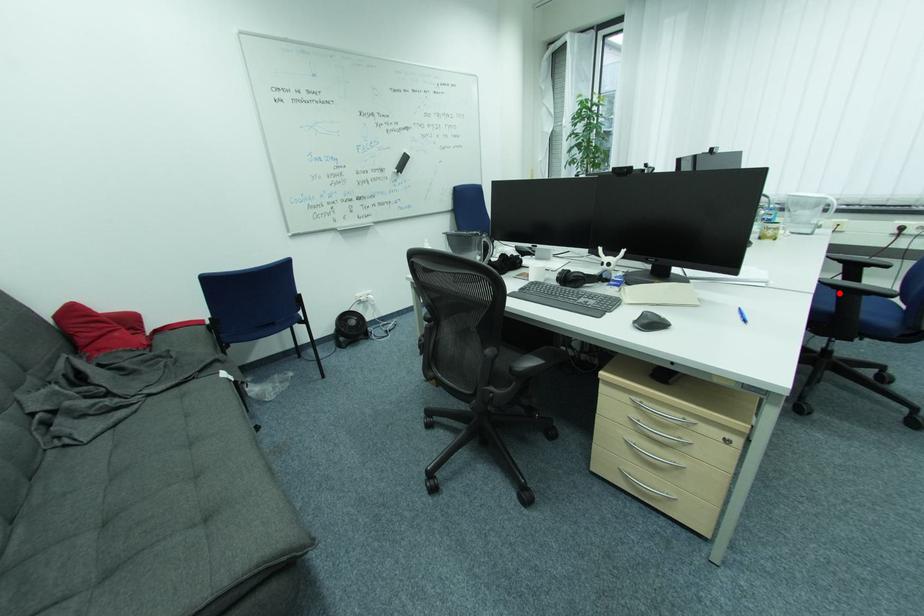
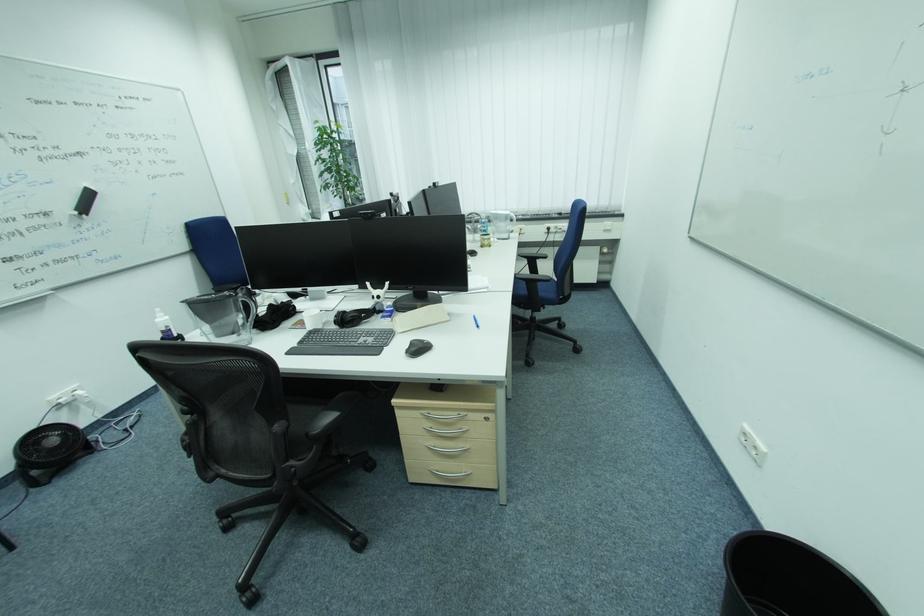
Question: I am providing you with two images of the same scene from different viewpoints. A red point is marked on the first image. At the location where the point appears in image 1, is it still visible in image 2?

Choices:
 (A) Yes
 (B) No

Answer: (A)